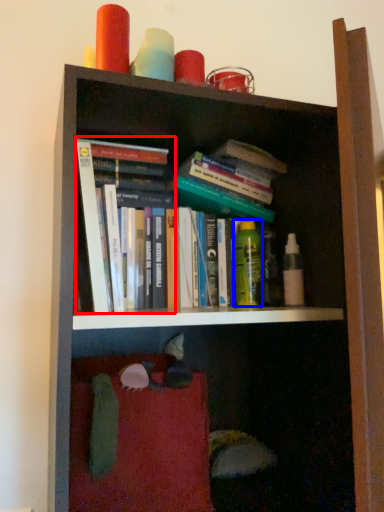
Question: Which object is further to the camera taking this photo, book (highlighted by a red box) or toiletry (highlighted by a blue box)?

Choices:
 (A) book
 (B) toiletry

Answer: (B)